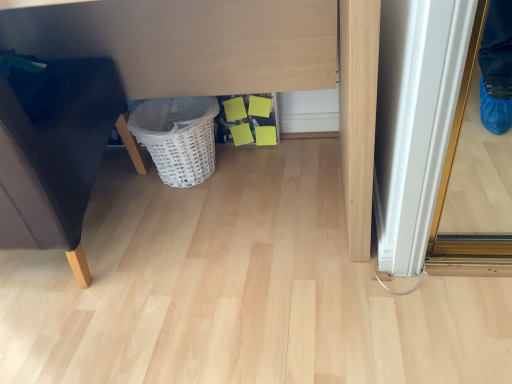
What do you see at coordinates (178, 137) in the screenshot?
I see `white wicker basket at lower center` at bounding box center [178, 137].

This screenshot has width=512, height=384. Describe the element at coordinates (59, 157) in the screenshot. I see `matte black sofa at left` at that location.

You are a GUI agent. You are given a task and a screenshot of the screen. Output one action in this format:
    pyautogui.click(x=<x>, y=<y>)
    Task: Click on the white wicker basket at lower center
    This screenshot has width=512, height=384.
    Given the screenshot: What is the action you would take?
    pyautogui.click(x=178, y=137)

Which is in front, point (62, 195) or point (175, 102)?

The point (62, 195) is closer to the camera.

Which object is wider, matte black sofa at left or white wicker basket at lower center?

matte black sofa at left.

From the image's perspective, is matte black sofa at left below white wicker basket at lower center?

Yes.

Considering the sizes of white wicker basket at lower center and matte white vanity at center in the image, is white wicker basket at lower center taller or shorter than matte white vanity at center?

white wicker basket at lower center is shorter than matte white vanity at center.

How distant is white wicker basket at lower center from matte white vanity at center?

9.47 inches.

Would you say white wicker basket at lower center is inside or outside matte white vanity at center?

white wicker basket at lower center exists entirely within matte white vanity at center.

Based on the photo, how different are the orientations of white wicker basket at lower center and matte white vanity at center in degrees?

The angular difference between white wicker basket at lower center and matte white vanity at center is 0.000198 degrees.

Which of these two, matte white vanity at center or matte black sofa at left, is bigger?

Bigger between the two is matte white vanity at center.

From the image's perspective, which object appears higher, matte white vanity at center or matte black sofa at left?

matte white vanity at center is shown above in the image.

Based on the photo, do you think matte white vanity at center is within matte black sofa at left, or outside of it?

matte white vanity at center is not enclosed by matte black sofa at left.

From their relative heights in the image, would you say matte white vanity at center is taller or shorter than matte black sofa at left?

matte white vanity at center is taller than matte black sofa at left.

Who is shorter, white wicker basket at lower center or matte black sofa at left?

white wicker basket at lower center.

Would you say white wicker basket at lower center is outside matte black sofa at left?

That's correct, white wicker basket at lower center is outside of matte black sofa at left.

From the image's perspective, is white wicker basket at lower center on matte black sofa at left?

Yes, from the image's perspective, white wicker basket at lower center is over matte black sofa at left.

Is point (21, 116) closer or farther from the camera than point (153, 37)?

Clearly, point (21, 116) is closer to the camera than point (153, 37).

This screenshot has width=512, height=384. I want to click on vanity above the matte black sofa at left (from a real-world perspective), so click(233, 61).

Which is in front, matte black sofa at left or matte white vanity at center?

matte black sofa at left is more forward.

Considering the sizes of objects matte black sofa at left and matte white vanity at center in the image provided, who is bigger, matte black sofa at left or matte white vanity at center?

Bigger between the two is matte white vanity at center.

Considering the relative positions of matte white vanity at center and white wicker basket at lower center in the image provided, is matte white vanity at center to the left or to the right of white wicker basket at lower center?

matte white vanity at center is positioned on white wicker basket at lower center's left side.

Considering the sizes of objects matte white vanity at center and white wicker basket at lower center in the image provided, who is taller, matte white vanity at center or white wicker basket at lower center?

With more height is matte white vanity at center.

From a real-world perspective, is matte white vanity at center positioned above or below white wicker basket at lower center?

From a real-world perspective, matte white vanity at center is physically above white wicker basket at lower center.

I want to click on basket directly beneath the matte black sofa at left (from a real-world perspective), so click(178, 137).

Locate an element on the screen. The height and width of the screenshot is (384, 512). vanity above the white wicker basket at lower center (from the image's perspective) is located at coordinates (233, 61).

Based on their spatial positions, is matte black sofa at left or white wicker basket at lower center closer to matte white vanity at center?

Among the two, white wicker basket at lower center is located nearer to matte white vanity at center.

Which object lies further to the anchor point matte white vanity at center, white wicker basket at lower center or matte black sofa at left?

matte black sofa at left is positioned further to the anchor matte white vanity at center.

When comparing their distances from white wicker basket at lower center, does matte white vanity at center or matte black sofa at left seem further?

Among the two, matte black sofa at left is located further to white wicker basket at lower center.

From the image, which object appears to be nearer to matte black sofa at left, white wicker basket at lower center or matte white vanity at center?

The object closer to matte black sofa at left is white wicker basket at lower center.

Estimate the real-world distances between objects in this image. Which object is closer to white wicker basket at lower center, matte black sofa at left or matte white vanity at center?

Based on the image, matte white vanity at center appears to be nearer to white wicker basket at lower center.

Consider the image. Based on their spatial positions, is matte white vanity at center or white wicker basket at lower center closer to matte black sofa at left?

Based on the image, white wicker basket at lower center appears to be nearer to matte black sofa at left.

I want to click on vanity between matte black sofa at left and white wicker basket at lower center along the z-axis, so click(233, 61).